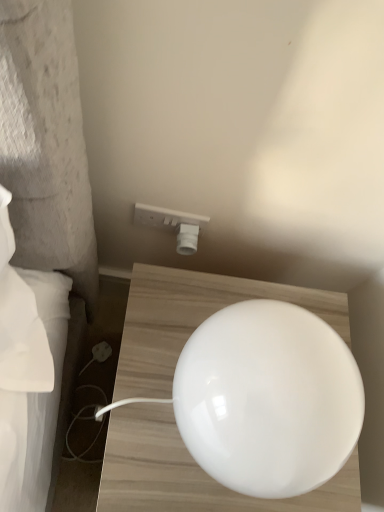
Find the location of a particular element. empty space that is ontop of white glossy lampshade at center is located at coordinates (298, 386).